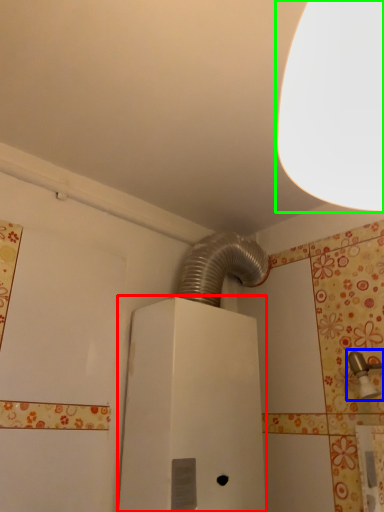
Question: Estimate the real-world distances between objects in this image. Which object is farther from water heater (highlighted by a red box), plumbing fixture (highlighted by a blue box) or lamp (highlighted by a green box)?

Choices:
 (A) plumbing fixture
 (B) lamp

Answer: (B)